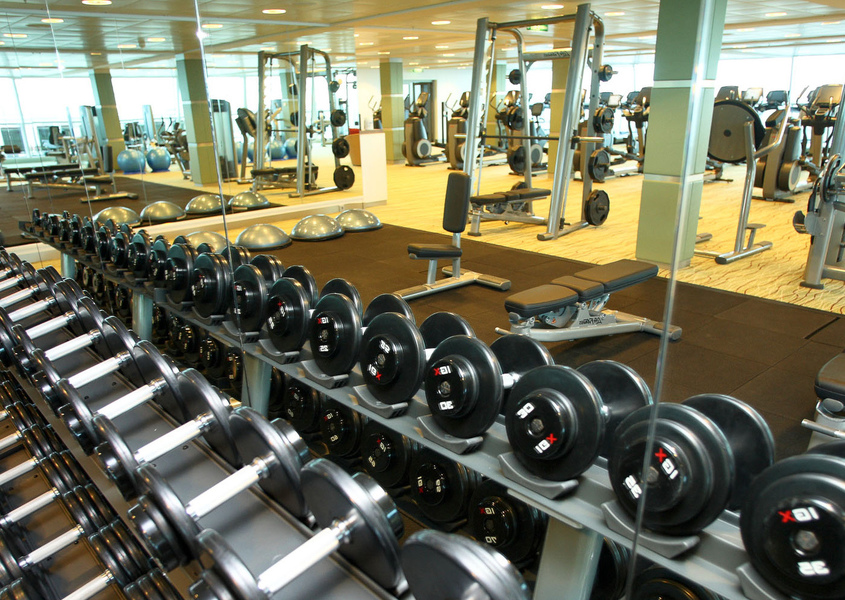
This screenshot has height=600, width=845. I want to click on mirrors, so click(x=248, y=183), click(x=154, y=147), click(x=45, y=150), click(x=769, y=264).